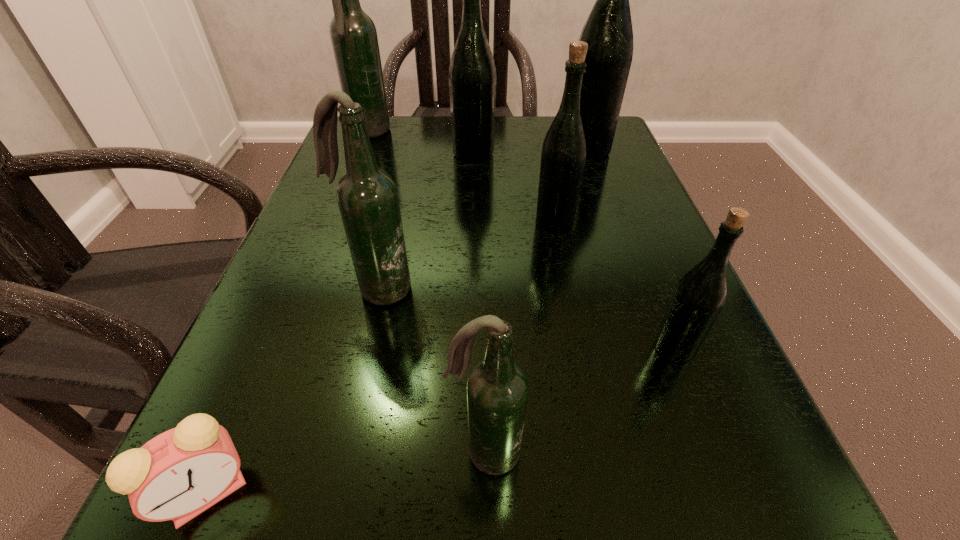
Locate an element on the screen. Image resolution: width=960 pixels, height=540 pixels. vacant space positioned 0.370m on the left of the smallest green beer bottle is located at coordinates (378, 348).

Locate an element on the screen. vacant space located on the back of the nearest dark beer bottle is located at coordinates (484, 350).

You are a GUI agent. You are given a task and a screenshot of the screen. Output one action in this format:
    pyautogui.click(x=<x>, y=<y>)
    Task: Click on the object that is at the near edge
    This screenshot has width=960, height=540.
    Given the screenshot: What is the action you would take?
    pyautogui.click(x=177, y=475)

Locate an element on the screen. This screenshot has width=960, height=540. alarm clock present at the left edge is located at coordinates (177, 475).

Identify the location of object that is at the far left corner. (353, 34).

This screenshot has height=540, width=960. Identify the location of object located at the near left corner. (177, 475).

Locate an element on the screen. This screenshot has height=540, width=960. object at the far right corner is located at coordinates (608, 31).

Find the location of a particular element. vacant space at the far edge of the desktop is located at coordinates (439, 163).

The image size is (960, 540). In the image, there is a desktop. Identify the location of vacant space at the near edge. (373, 500).

This screenshot has width=960, height=540. I want to click on vacant space at the left edge, so click(314, 303).